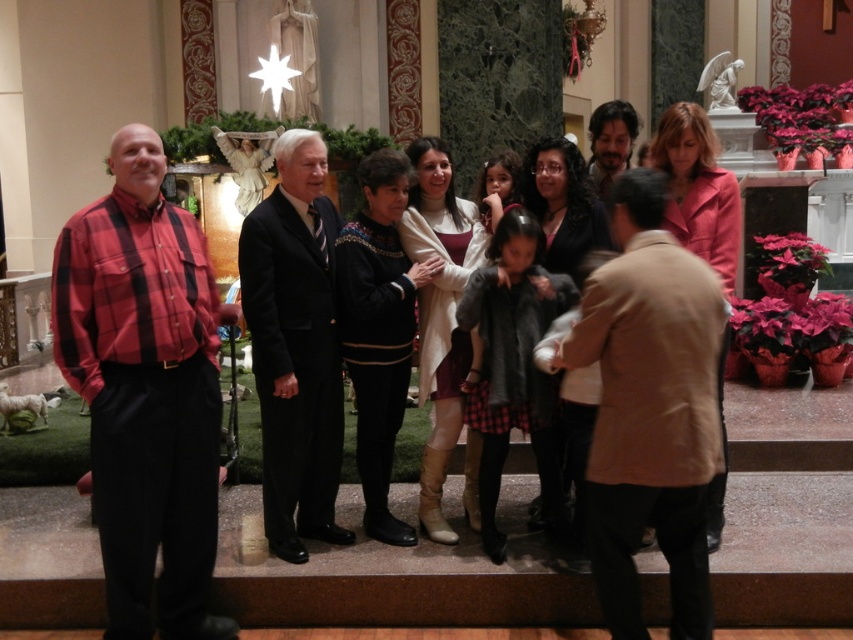
Question: Which point is farther to the camera?

Choices:
 (A) plaid cotton shirt at left
 (B) dark suit at center
 (C) plaid shirt at left
 (D) dark brown leather jacket at center

Answer: (D)

Question: Which point is farther to the camera?

Choices:
 (A) tan leather jacket at center
 (B) plaid shirt at left
 (C) dark suit at center

Answer: (C)

Question: Can you confirm if tan leather jacket at center is thinner than plaid shirt at left?

Choices:
 (A) yes
 (B) no

Answer: (A)

Question: Which point appears farthest from the camera in this image?

Choices:
 (A) (608, 176)
 (B) (585, 492)

Answer: (A)

Question: Is plaid cotton shirt at left closer to the viewer compared to dark brown leather jacket at center?

Choices:
 (A) no
 (B) yes

Answer: (B)

Question: Can you confirm if plaid shirt at left is positioned below dark brown leather jacket at center?

Choices:
 (A) no
 (B) yes

Answer: (B)